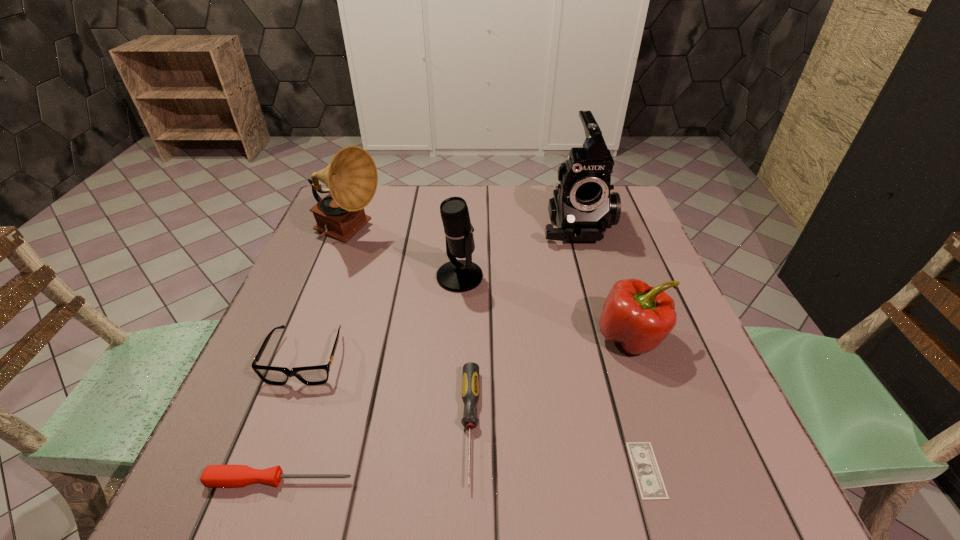
The image size is (960, 540). Find the location of `free spot located on the lens mount of the camcorder`. free spot located on the lens mount of the camcorder is located at coordinates (594, 288).

You are a GUI agent. You are given a task and a screenshot of the screen. Output one action in this format:
    pyautogui.click(x=<x>, y=<y>)
    Task: Click on the free space located 0.310m on the horn of the phonograph record
    
    Given the screenshot: What is the action you would take?
    pyautogui.click(x=498, y=234)

Where is `vacant space located on the right of the sixth shortest object`? The image size is (960, 540). vacant space located on the right of the sixth shortest object is located at coordinates (576, 277).

Identify the location of blank space located on the front of the pepper. (652, 400).

What are the coordinates of `free space located 0.130m on the front-facing side of the sunglasses` in the screenshot? It's located at (271, 453).

You are a GUI agent. You are given a task and a screenshot of the screen. Output one action in this format:
    pyautogui.click(x=<x>, y=<y>)
    Task: Click on the vacant space located 0.130m at the tip of the shorter screwdriver
    This screenshot has width=960, height=540.
    Given the screenshot: What is the action you would take?
    pyautogui.click(x=433, y=480)

Locate an element on the screen. blank space located on the back of the money is located at coordinates (612, 348).

The width and height of the screenshot is (960, 540). I want to click on camcorder situated at the far edge, so click(582, 206).

You are a GUI agent. You are given a task and a screenshot of the screen. Output one action in this format:
    pyautogui.click(x=<x>, y=<y>)
    Task: Click on the phonograph record that is at the far edge
    This screenshot has width=960, height=540.
    Given the screenshot: What is the action you would take?
    pyautogui.click(x=351, y=177)

This screenshot has width=960, height=540. Identify the location of money present at the near edge. (650, 483).